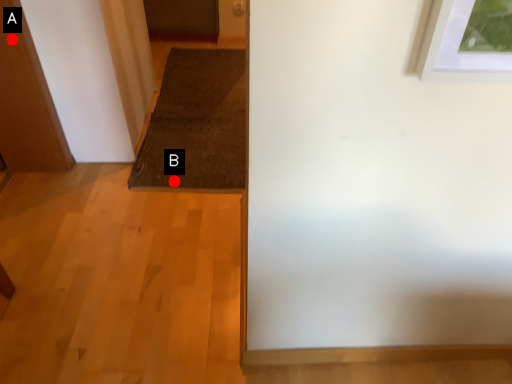
Question: Two points are circled on the image, labeled by A and B beside each circle. Which of the following is the farthest from the observer?

Choices:
 (A) A is further
 (B) B is further

Answer: (B)